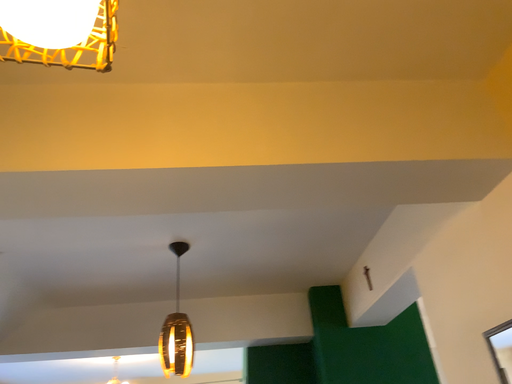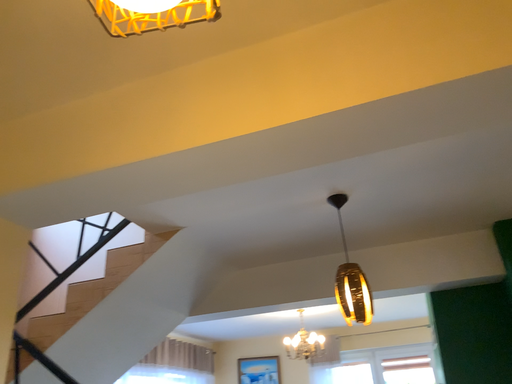
Question: How did the camera likely rotate when shooting the video?

Choices:
 (A) rotated left
 (B) rotated right

Answer: (A)